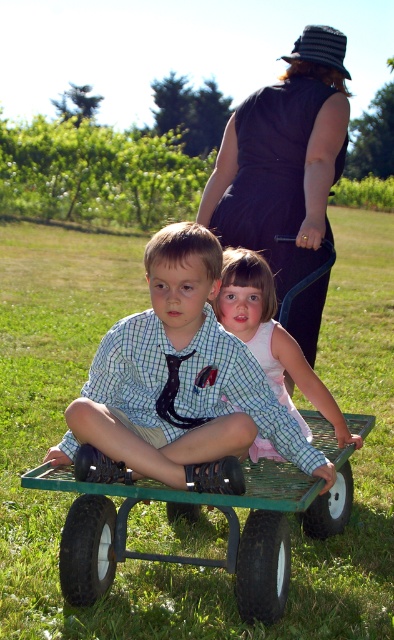
Based on the photo, can you confirm if checkered fabric shirt at center is positioned above green metal wagon at center?

Indeed, checkered fabric shirt at center is positioned over green metal wagon at center.

This screenshot has width=394, height=640. Identify the location of checkered fabric shirt at center. (180, 378).

Does point (202, 353) come behind point (310, 483)?

No, (202, 353) is in front of (310, 483).

Locate an element on the screen. This screenshot has height=640, width=394. checkered fabric shirt at center is located at coordinates (180, 378).

Is checkered fabric shirt at center positioned at the back of pink satin dress at center?

No, it is not.

What do you see at coordinates (180, 378) in the screenshot?
I see `checkered fabric shirt at center` at bounding box center [180, 378].

Measure the distance between checkered fabric shirt at center and camera.

They are 3.11 meters apart.

Where is `checkered fabric shirt at center`? checkered fabric shirt at center is located at coordinates (180, 378).

Is green metal wagon at center smaller than pink satin dress at center?

No, green metal wagon at center is not smaller than pink satin dress at center.

Between green metal wagon at center and pink satin dress at center, which one has more height?

pink satin dress at center

The width and height of the screenshot is (394, 640). Describe the element at coordinates (198, 508) in the screenshot. I see `green metal wagon at center` at that location.

Identify the location of green metal wagon at center. (198, 508).